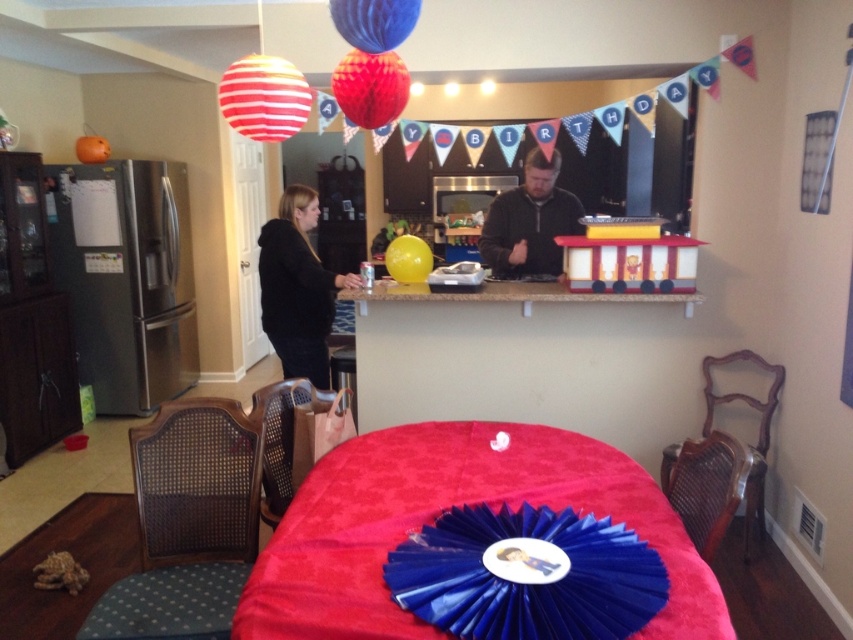
Between point (363, 24) and point (421, 257), which one is positioned behind?

The point (421, 257) is behind.

The height and width of the screenshot is (640, 853). In order to click on blue glossy balloon at upper center in this screenshot , I will do `click(374, 20)`.

Is point (374, 49) farther from viewer compared to point (405, 237)?

No.

I want to click on blue glossy balloon at upper center, so click(374, 20).

Does black fleece jacket at center appear over shiny red balloon at upper center?

No.

Is black fleece jacket at center thinner than shiny red balloon at upper center?

No, black fleece jacket at center is not thinner than shiny red balloon at upper center.

Does point (503, 250) come behind point (349, 65)?

That is True.

You are a GUI agent. You are given a task and a screenshot of the screen. Output one action in this format:
    pyautogui.click(x=<x>, y=<y>)
    Task: Click on the black fleece jacket at center
    
    Given the screenshot: What is the action you would take?
    pyautogui.click(x=531, y=221)

Who is positioned more to the right, red velvet table at center or blue glossy balloon at upper center?

Positioned to the right is red velvet table at center.

Does point (508, 419) lie behind point (344, 4)?

Yes, it is behind point (344, 4).

Where is `red velvet table at center`? red velvet table at center is located at coordinates (527, 356).